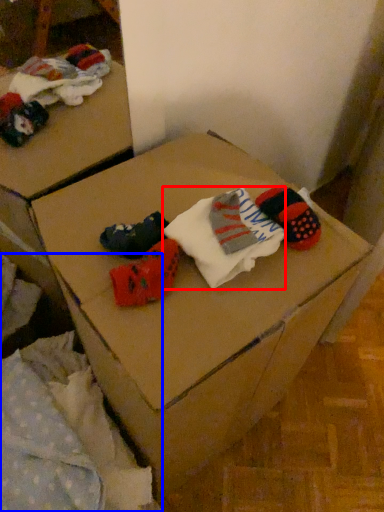
Question: Among these objects, which one is farthest to the camera, sock (highlighted by a red box) or bedding (highlighted by a blue box)?

Choices:
 (A) sock
 (B) bedding

Answer: (A)